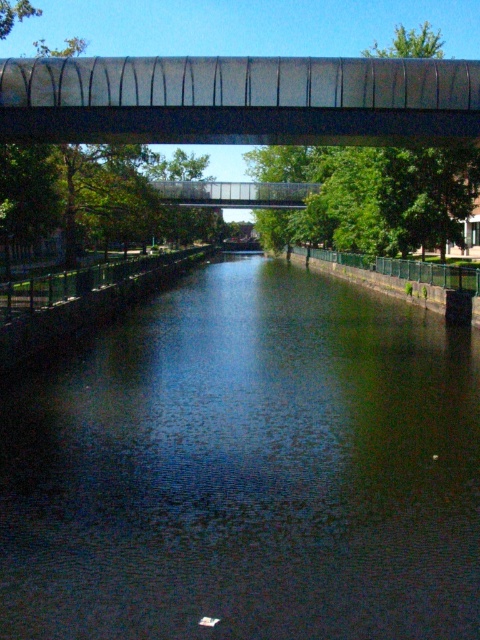
Question: Which of the following is the farthest from the observer?

Choices:
 (A) (388, 515)
 (B) (197, 97)
 (C) (238, 205)

Answer: (C)

Question: Which is nearer to the metallic gray bridge at upper center?

Choices:
 (A) dark reflective water at center
 (B) transparent glass bridge at center

Answer: (A)

Question: Does metallic gray bridge at upper center appear on the left side of transparent glass bridge at center?

Choices:
 (A) yes
 (B) no

Answer: (B)

Question: Which of these objects is positioned farthest from the dark reflective water at center?

Choices:
 (A) transparent glass bridge at center
 (B) metallic gray bridge at upper center

Answer: (A)

Question: Considering the relative positions of dark reflective water at center and transparent glass bridge at center in the image provided, where is dark reflective water at center located with respect to transparent glass bridge at center?

Choices:
 (A) below
 (B) above

Answer: (A)

Question: Observing the image, what is the correct spatial positioning of dark reflective water at center in reference to metallic gray bridge at upper center?

Choices:
 (A) below
 (B) above

Answer: (A)